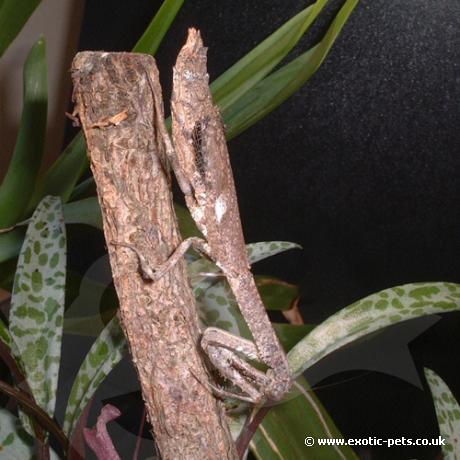
Find the location of a particular element. green plants is located at coordinates (38, 78), (72, 169), (258, 53), (288, 85).